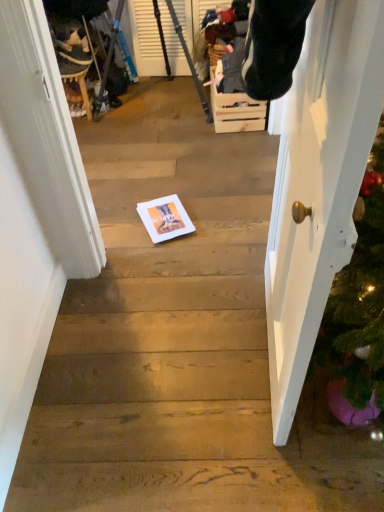
At what (x,y) coordinates should I click in order to perform the action: click on vacant space situated on the left part of wooden crate at center. Please return your answer as a coordinate pair (x, y). The image size is (384, 512). Looking at the image, I should click on (173, 115).